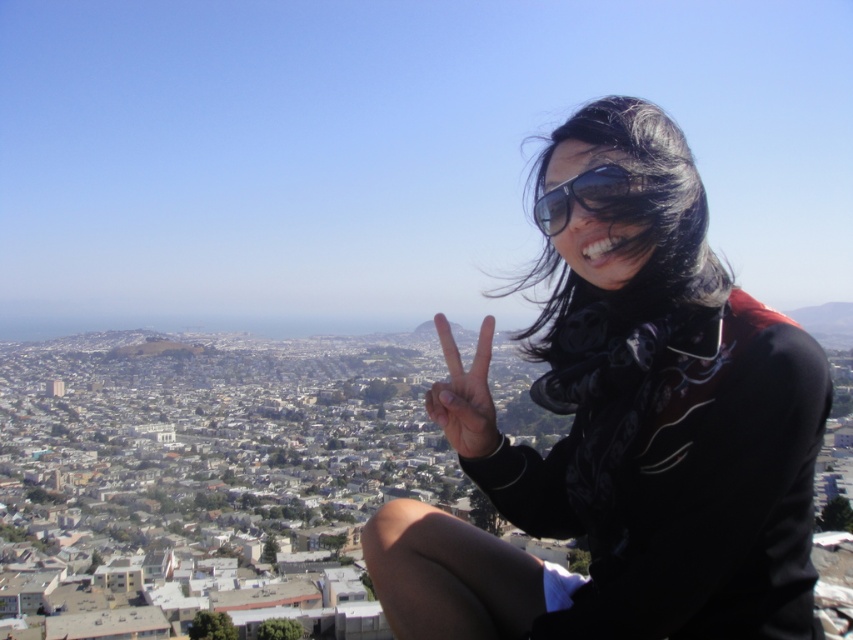
Question: Can you confirm if black matte scarf at right is positioned to the left of matte skin hand at center?

Choices:
 (A) yes
 (B) no

Answer: (B)

Question: Which point appears farthest from the camera in this image?

Choices:
 (A) (485, 609)
 (B) (462, 372)

Answer: (B)

Question: Is matte skin hand at center above sunglasses at upper right?

Choices:
 (A) yes
 (B) no

Answer: (B)

Question: Estimate the real-world distances between objects in this image. Which object is closer to the matte skin hand at center?

Choices:
 (A) black matte scarf at right
 (B) sunglasses at upper right

Answer: (A)

Question: Can you confirm if black matte scarf at right is bigger than sunglasses at upper right?

Choices:
 (A) no
 (B) yes

Answer: (B)

Question: Which point is farther to the camera?

Choices:
 (A) (438, 332)
 (B) (550, 218)

Answer: (A)